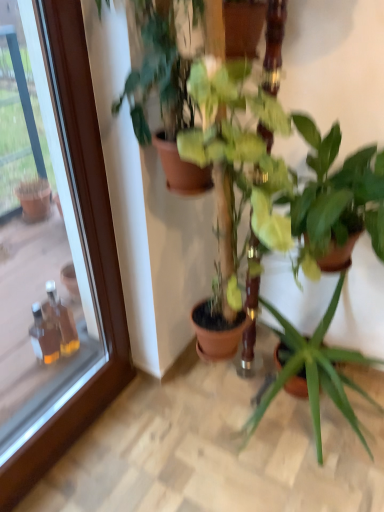
What do you see at coordinates (38, 252) in the screenshot? The height and width of the screenshot is (512, 384). I see `transparent glass door at upper left` at bounding box center [38, 252].

Locate an element on the screen. transparent glass door at upper left is located at coordinates (38, 252).

You are a GUI agent. You are given a task and a screenshot of the screen. Output one action in this format:
    pyautogui.click(x=<x>, y=<y>)
    Task: Click on the green matte plant at center, acting as the 4th houseplant starting from the left
    
    Given the screenshot: What is the action you would take?
    pyautogui.click(x=315, y=372)

What do you see at coordinates (336, 194) in the screenshot?
I see `green glossy plant at center, positioned as the second houseplant in right-to-left order` at bounding box center [336, 194].

You are a GUI agent. You are given a task and a screenshot of the screen. Output one action in this format:
    pyautogui.click(x=<x>, y=<y>)
    Task: Click on the green matte plant at center, acting as the 4th houseplant starting from the right
    
    Given the screenshot: What is the action you would take?
    pyautogui.click(x=163, y=94)

The height and width of the screenshot is (512, 384). Identify the location of transparent glass door at upper left. (38, 252).

From the picture: Is green glossy plant at center, which appears as the 3th houseplant when viewed from the right, located outside transparent glass door at upper left?

green glossy plant at center, which appears as the 3th houseplant when viewed from the right, is positioned outside transparent glass door at upper left.

Is transparent glass door at upper left at the back of green glossy plant at center, the 2th houseplant when ordered from left to right?

No, green glossy plant at center, the 2th houseplant when ordered from left to right, is not facing the opposite direction of transparent glass door at upper left.

Is the position of green glossy plant at center, which appears as the 3th houseplant when viewed from the right, more distant than that of transparent glass door at upper left?

Yes, it is behind transparent glass door at upper left.

Locate an element on the screen. The height and width of the screenshot is (512, 384). glass door that is below the green glossy plant at center, the 2th houseplant when ordered from left to right (from the image's perspective) is located at coordinates (38, 252).

In terms of height, does transparent glass door at upper left look taller or shorter compared to green glossy plant at center, which appears as the 3th houseplant when viewed from the right?

In the image, transparent glass door at upper left appears to be taller than green glossy plant at center, which appears as the 3th houseplant when viewed from the right.

Between transparent glass door at upper left and green glossy plant at center, the 2th houseplant when ordered from left to right, which one has smaller size?

green glossy plant at center, the 2th houseplant when ordered from left to right.

Is transparent glass door at upper left located outside green glossy plant at center, which appears as the 3th houseplant when viewed from the right?

Yes, transparent glass door at upper left is not within green glossy plant at center, which appears as the 3th houseplant when viewed from the right.

Is transparent glass door at upper left closer to the viewer compared to green glossy plant at center, the 2th houseplant when ordered from left to right?

That is True.

Which of these two, green glossy plant at center, the 2th houseplant when ordered from left to right, or green glossy plant at center, which is counted as the third houseplant, starting from the left, stands shorter?

With less height is green glossy plant at center, which is counted as the third houseplant, starting from the left.

What are the coordinates of `the 1st houseplant counting from the right side of the green glossy plant at center, the 2th houseplant when ordered from left to right` in the screenshot? It's located at (336, 194).

Which object is closer to the camera taking this photo, green glossy plant at center, which appears as the 3th houseplant when viewed from the right, or green glossy plant at center, positioned as the second houseplant in right-to-left order?

green glossy plant at center, which appears as the 3th houseplant when viewed from the right, is more forward.

Is green matte plant at center, acting as the 4th houseplant starting from the right, thinner than green glossy plant at center, the 2th houseplant when ordered from left to right?

Indeed, green matte plant at center, acting as the 4th houseplant starting from the right, has a lesser width compared to green glossy plant at center, the 2th houseplant when ordered from left to right.

Is green matte plant at center, acting as the 4th houseplant starting from the right, not near green glossy plant at center, which appears as the 3th houseplant when viewed from the right?

No, green matte plant at center, acting as the 4th houseplant starting from the right, is in close proximity to green glossy plant at center, which appears as the 3th houseplant when viewed from the right.

This screenshot has width=384, height=512. What are the coordinates of `houseplant that is the 2nd object above the green glossy plant at center, the 2th houseplant when ordered from left to right (from a real-world perspective)` in the screenshot? It's located at pyautogui.click(x=163, y=94).

Is green matte plant at center, which ranks as the 1th houseplant in left-to-right order, inside or outside of green glossy plant at center, which appears as the 3th houseplant when viewed from the right?

green matte plant at center, which ranks as the 1th houseplant in left-to-right order, cannot be found inside green glossy plant at center, which appears as the 3th houseplant when viewed from the right.

How different are the orientations of green glossy plant at center, which is counted as the third houseplant, starting from the left, and green matte plant at center, the 1th houseplant positioned from the right, in degrees?

There is a 0.08-degree angle between the facing directions of green glossy plant at center, which is counted as the third houseplant, starting from the left, and green matte plant at center, the 1th houseplant positioned from the right.

From the image's perspective, which is below, green glossy plant at center, which is counted as the third houseplant, starting from the left, or green matte plant at center, acting as the 4th houseplant starting from the left?

green matte plant at center, acting as the 4th houseplant starting from the left, appears lower in the image.

Looking at this image, between green glossy plant at center, positioned as the second houseplant in right-to-left order, and green matte plant at center, acting as the 4th houseplant starting from the left, which one is positioned behind?

Positioned behind is green matte plant at center, acting as the 4th houseplant starting from the left.

Measure the distance between green glossy plant at center, which is counted as the third houseplant, starting from the left, and green matte plant at center, acting as the 4th houseplant starting from the left.

green glossy plant at center, which is counted as the third houseplant, starting from the left, and green matte plant at center, acting as the 4th houseplant starting from the left, are 22.19 inches apart.

Does green matte plant at center, acting as the 4th houseplant starting from the left, touch green glossy plant at center, which appears as the 3th houseplant when viewed from the right?

No, green matte plant at center, acting as the 4th houseplant starting from the left, is not touching green glossy plant at center, which appears as the 3th houseplant when viewed from the right.

How much distance is there between green matte plant at center, acting as the 4th houseplant starting from the left, and green glossy plant at center, the 2th houseplant when ordered from left to right?

70.36 centimeters.

Can you tell me how much green matte plant at center, acting as the 4th houseplant starting from the left, and green glossy plant at center, which appears as the 3th houseplant when viewed from the right, differ in facing direction?

0.265 degrees.

Is green matte plant at center, acting as the 4th houseplant starting from the left, facing away from green glossy plant at center, which appears as the 3th houseplant when viewed from the right?

green matte plant at center, acting as the 4th houseplant starting from the left, does not have its back to green glossy plant at center, which appears as the 3th houseplant when viewed from the right.

Consider the image. Can you confirm if green glossy plant at center, which is counted as the third houseplant, starting from the left, is positioned to the left of green glossy plant at center, which appears as the 3th houseplant when viewed from the right?

No.

Would you say green glossy plant at center, positioned as the second houseplant in right-to-left order, is a long distance from green glossy plant at center, which appears as the 3th houseplant when viewed from the right?

Actually, green glossy plant at center, positioned as the second houseplant in right-to-left order, and green glossy plant at center, which appears as the 3th houseplant when viewed from the right, are a little close together.

Could you measure the distance between green glossy plant at center, positioned as the second houseplant in right-to-left order, and green glossy plant at center, which appears as the 3th houseplant when viewed from the right?

2.09 inches.

The width and height of the screenshot is (384, 512). In order to click on glass door beneath the green glossy plant at center, the 2th houseplant when ordered from left to right (from a real-world perspective) in this screenshot , I will do `click(38, 252)`.

The height and width of the screenshot is (512, 384). In the image, there is a green glossy plant at center, which appears as the 3th houseplant when viewed from the right. In order to click on glass door below it (from the image's perspective) in this screenshot , I will do `click(38, 252)`.

Considering their positions, is green matte plant at center, acting as the 4th houseplant starting from the left, positioned further to green glossy plant at center, positioned as the second houseplant in right-to-left order, than green glossy plant at center, the 2th houseplant when ordered from left to right?

green matte plant at center, acting as the 4th houseplant starting from the left, is further to green glossy plant at center, positioned as the second houseplant in right-to-left order.

From the image, which object appears to be farther from green glossy plant at center, the 2th houseplant when ordered from left to right, green matte plant at center, acting as the 4th houseplant starting from the right, or green glossy plant at center, positioned as the second houseplant in right-to-left order?

green matte plant at center, acting as the 4th houseplant starting from the right, is further to green glossy plant at center, the 2th houseplant when ordered from left to right.

Which object lies further to the anchor point green glossy plant at center, which is counted as the third houseplant, starting from the left, green matte plant at center, acting as the 4th houseplant starting from the right, or transparent glass door at upper left?

transparent glass door at upper left.

Considering their positions, is green glossy plant at center, which appears as the 3th houseplant when viewed from the right, positioned further to transparent glass door at upper left than green matte plant at center, acting as the 4th houseplant starting from the left?

green matte plant at center, acting as the 4th houseplant starting from the left, is further to transparent glass door at upper left.

Considering their positions, is green glossy plant at center, which is counted as the third houseplant, starting from the left, positioned further to green glossy plant at center, the 2th houseplant when ordered from left to right, than green matte plant at center, acting as the 4th houseplant starting from the right?

green matte plant at center, acting as the 4th houseplant starting from the right, lies further to green glossy plant at center, the 2th houseplant when ordered from left to right, than the other object.

Looking at the image, which one is located further to transparent glass door at upper left, green matte plant at center, acting as the 4th houseplant starting from the left, or green glossy plant at center, which is counted as the third houseplant, starting from the left?

The object further to transparent glass door at upper left is green matte plant at center, acting as the 4th houseplant starting from the left.

Considering their positions, is green glossy plant at center, which appears as the 3th houseplant when viewed from the right, positioned closer to transparent glass door at upper left than green matte plant at center, acting as the 4th houseplant starting from the right?

green matte plant at center, acting as the 4th houseplant starting from the right.

From the image, which object appears to be farther from green glossy plant at center, which appears as the 3th houseplant when viewed from the right, green matte plant at center, acting as the 4th houseplant starting from the right, or green matte plant at center, acting as the 4th houseplant starting from the left?

green matte plant at center, acting as the 4th houseplant starting from the left, lies further to green glossy plant at center, which appears as the 3th houseplant when viewed from the right, than the other object.

Locate an element on the screen. This screenshot has width=384, height=512. houseplant between green glossy plant at center, positioned as the second houseplant in right-to-left order, and green matte plant at center, acting as the 4th houseplant starting from the left, in the vertical direction is located at coordinates (323, 371).

What are the coordinates of `houseplant between green matte plant at center, acting as the 4th houseplant starting from the right, and green glossy plant at center, positioned as the second houseplant in right-to-left order, from left to right` in the screenshot? It's located at (323, 371).

Identify the location of houseplant situated between transparent glass door at upper left and green glossy plant at center, which appears as the 3th houseplant when viewed from the right, from left to right. (163, 94).